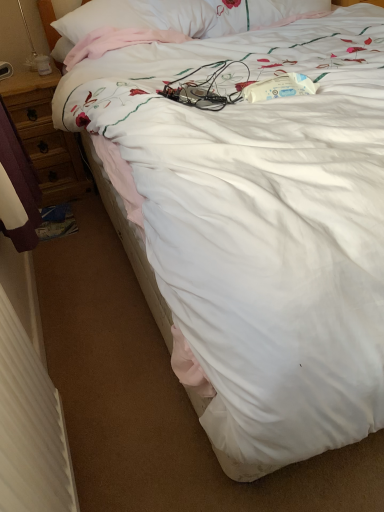
The image size is (384, 512). What do you see at coordinates (45, 136) in the screenshot? I see `wooden desk at left` at bounding box center [45, 136].

The height and width of the screenshot is (512, 384). What are the coordinates of `wooden desk at left` in the screenshot? It's located at coord(45,136).

This screenshot has height=512, width=384. I want to click on white textured radiator at lower left, so click(30, 426).

The width and height of the screenshot is (384, 512). What do you see at coordinates (30, 426) in the screenshot? I see `white textured radiator at lower left` at bounding box center [30, 426].

I want to click on wooden desk at left, so click(45, 136).

Considering the positions of objects white textured radiator at lower left and wooden desk at left in the image provided, who is more to the right, white textured radiator at lower left or wooden desk at left?

Positioned to the right is white textured radiator at lower left.

In the image, is white textured radiator at lower left positioned in front of or behind wooden desk at left?

white textured radiator at lower left is positioned closer to the viewer than wooden desk at left.

Does point (34, 447) come farther from viewer compared to point (10, 88)?

That is False.

From the image's perspective, which is below, white textured radiator at lower left or wooden desk at left?

white textured radiator at lower left appears lower in the image.

From a real-world perspective, between white textured radiator at lower left and wooden desk at left, who is vertically higher?

white textured radiator at lower left.

Is white textured radiator at lower left wider or thinner than wooden desk at left?

Considering their sizes, white textured radiator at lower left looks slimmer than wooden desk at left.

Considering the sizes of objects white textured radiator at lower left and wooden desk at left in the image provided, who is taller, white textured radiator at lower left or wooden desk at left?

With more height is wooden desk at left.

Who is smaller, white textured radiator at lower left or wooden desk at left?

white textured radiator at lower left is smaller.

Do you think white textured radiator at lower left is within wooden desk at left, or outside of it?

white textured radiator at lower left lies outside wooden desk at left.

Is white textured radiator at lower left with wooden desk at left?

They are not placed beside each other.

Could you tell me if white textured radiator at lower left is facing wooden desk at left?

No, white textured radiator at lower left is not oriented towards wooden desk at left.

What's the angular difference between white textured radiator at lower left and wooden desk at left's facing directions?

They differ by 90.3 degrees in their facing directions.

Where is `desk above the white textured radiator at lower left (from the image's perspective)`? The width and height of the screenshot is (384, 512). desk above the white textured radiator at lower left (from the image's perspective) is located at coordinates (45, 136).

Considering the positions of objects wooden desk at left and white textured radiator at lower left in the image provided, who is more to the left, wooden desk at left or white textured radiator at lower left?

wooden desk at left is more to the left.

Which object is further away from the camera taking this photo, wooden desk at left or white textured radiator at lower left?

Positioned behind is wooden desk at left.

Considering the positions of point (59, 158) and point (17, 415), is point (59, 158) closer or farther from the camera than point (17, 415)?

Point (59, 158).

From the image's perspective, is wooden desk at left on top of white textured radiator at lower left?

Yes, from the image's perspective, wooden desk at left is above white textured radiator at lower left.

From a real-world perspective, is wooden desk at left located higher than white textured radiator at lower left?

No, from a real-world perspective, wooden desk at left is not over white textured radiator at lower left

Considering the sizes of objects wooden desk at left and white textured radiator at lower left in the image provided, who is wider, wooden desk at left or white textured radiator at lower left?

wooden desk at left.

Between wooden desk at left and white textured radiator at lower left, which one has more height?

wooden desk at left.

Is wooden desk at left bigger or smaller than white textured radiator at lower left?

Clearly, wooden desk at left is larger in size than white textured radiator at lower left.

Can we say wooden desk at left lies outside white textured radiator at lower left?

That's correct, wooden desk at left is outside of white textured radiator at lower left.

Based on the photo, is wooden desk at left far from white textured radiator at lower left?

Yes.

Could you tell me if wooden desk at left is turned towards white textured radiator at lower left?

Yes, wooden desk at left is turned towards white textured radiator at lower left.

The width and height of the screenshot is (384, 512). In order to click on desk that appears behind the white textured radiator at lower left in this screenshot , I will do `click(45, 136)`.

At what (x,y) coordinates should I click in order to perform the action: click on radiator on the right of wooden desk at left. Please return your answer as a coordinate pair (x, y). Looking at the image, I should click on (30, 426).

Locate an element on the screen. Image resolution: width=384 pixels, height=512 pixels. radiator that appears below the wooden desk at left (from the image's perspective) is located at coordinates (30, 426).